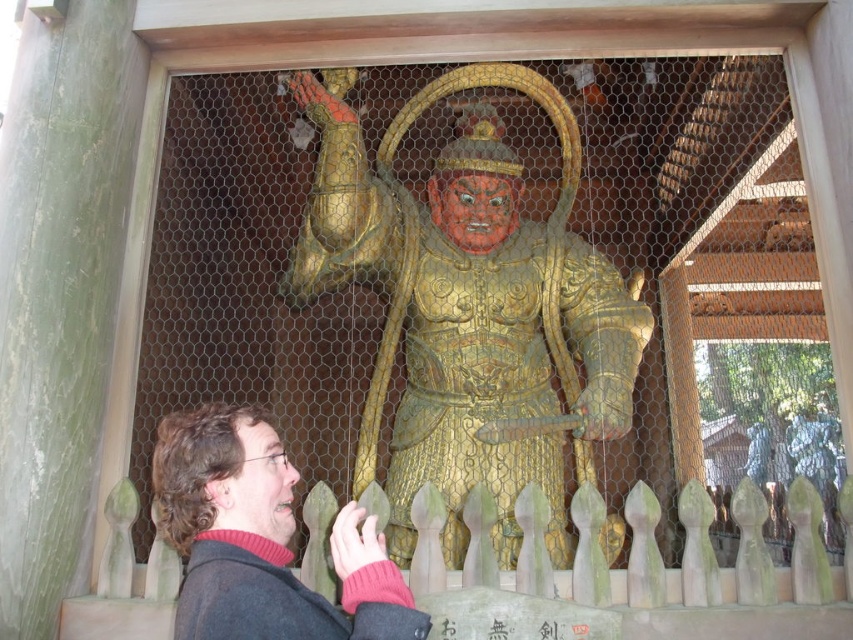
You are a painter trying to sketch the statue. You notice two elements in the scene, the gold textured armor at center and the dark brown hair at lower left. Which element should you focus on first if you want to draw the larger object first?

The gold textured armor at center is bigger than the dark brown hair at lower left, so you should focus on drawing the gold textured armor at center first.

In the scene shown: You are a tour guide leading a group to the gold textured armor at center. The safety regulations state that visitors must maintain a minimum distance of 200 feet from the armor. Can you confirm if the current viewing distance is compliant with the safety regulations?

The gold textured armor at center is currently 204.12 feet away from the viewer, which exceeds the required 200 feet minimum distance. Therefore, the current viewing distance complies with the safety regulations.